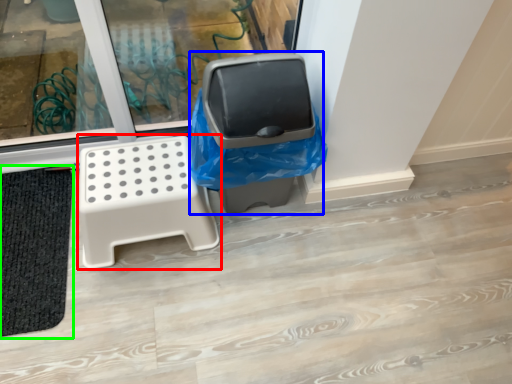
Question: Which is nearer to the furniture (highlighted by a red box)? garbage (highlighted by a blue box) or bath mat (highlighted by a green box).

Choices:
 (A) garbage
 (B) bath mat

Answer: (A)